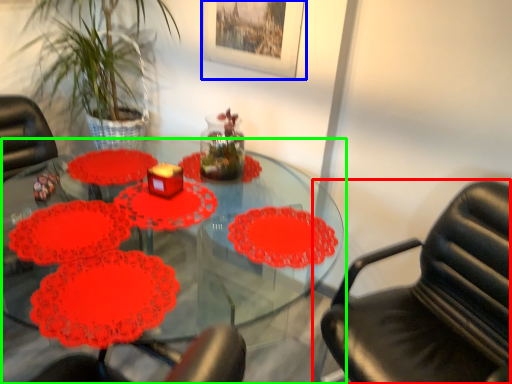
Question: Estimate the real-world distances between objects in this image. Which object is closer to chair (highlighted by a red box), picture frame (highlighted by a blue box) or table (highlighted by a green box)?

Choices:
 (A) picture frame
 (B) table

Answer: (B)